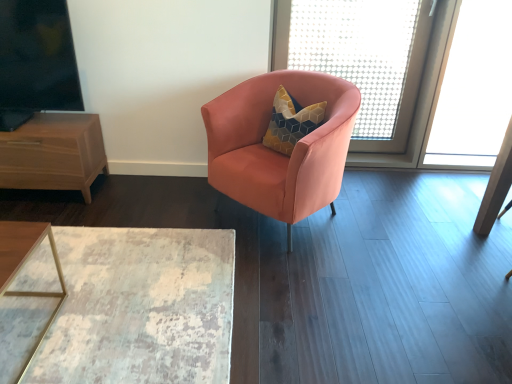
Question: Can you confirm if translucent mesh screen at upper right, which ranks as the first window screen in back-to-front order, is taller than black glass window screen at upper left, arranged as the 1th window screen when viewed from the front?

Choices:
 (A) yes
 (B) no

Answer: (A)

Question: Is translucent mesh screen at upper right, acting as the 1th window screen starting from the right, behind black glass window screen at upper left, which is the second window screen from right to left?

Choices:
 (A) yes
 (B) no

Answer: (A)

Question: From a real-world perspective, is translucent mesh screen at upper right, acting as the 1th window screen starting from the right, located beneath black glass window screen at upper left, arranged as the 1th window screen when viewed from the front?

Choices:
 (A) yes
 (B) no

Answer: (A)

Question: Is black glass window screen at upper left, which is the second window screen from right to left, a part of translucent mesh screen at upper right, acting as the 1th window screen starting from the right?

Choices:
 (A) yes
 (B) no

Answer: (B)

Question: Is translucent mesh screen at upper right, the 2th window screen positioned from the left, not close to black glass window screen at upper left, which is the second window screen from right to left?

Choices:
 (A) no
 (B) yes

Answer: (B)

Question: Visually, is translucent mesh screen at upper right, which is counted as the 2th window screen, starting from the front, positioned to the left or to the right of black glass window screen at upper left, arranged as the 1th window screen when viewed from the front?

Choices:
 (A) right
 (B) left

Answer: (A)

Question: Considering their positions, is translucent mesh screen at upper right, acting as the 1th window screen starting from the right, located in front of or behind black glass window screen at upper left, acting as the 1th window screen starting from the left?

Choices:
 (A) behind
 (B) front

Answer: (A)

Question: Is point (376, 150) closer or farther from the camera than point (32, 64)?

Choices:
 (A) farther
 (B) closer

Answer: (A)

Question: In terms of size, does translucent mesh screen at upper right, acting as the 1th window screen starting from the right, appear bigger or smaller than black glass window screen at upper left, which is the second window screen from right to left?

Choices:
 (A) big
 (B) small

Answer: (A)

Question: From the image's perspective, is satin peach armchair at center above or below black glass window screen at upper left, which is the second window screen from right to left?

Choices:
 (A) below
 (B) above

Answer: (A)

Question: Based on their positions, is satin peach armchair at center located to the left or right of black glass window screen at upper left, acting as the 1th window screen starting from the left?

Choices:
 (A) left
 (B) right

Answer: (B)

Question: In terms of width, does satin peach armchair at center look wider or thinner when compared to black glass window screen at upper left, which is the second window screen from right to left?

Choices:
 (A) wide
 (B) thin

Answer: (A)

Question: From a real-world perspective, is satin peach armchair at center above or below black glass window screen at upper left, arranged as the 1th window screen when viewed from the front?

Choices:
 (A) below
 (B) above

Answer: (A)

Question: Considering the relative positions of translucent mesh screen at upper right, the 2th window screen positioned from the left, and distressed wood table at lower left in the image provided, is translucent mesh screen at upper right, the 2th window screen positioned from the left, to the left or to the right of distressed wood table at lower left?

Choices:
 (A) left
 (B) right

Answer: (B)

Question: From their relative heights in the image, would you say translucent mesh screen at upper right, which is counted as the 2th window screen, starting from the front, is taller or shorter than distressed wood table at lower left?

Choices:
 (A) short
 (B) tall

Answer: (B)